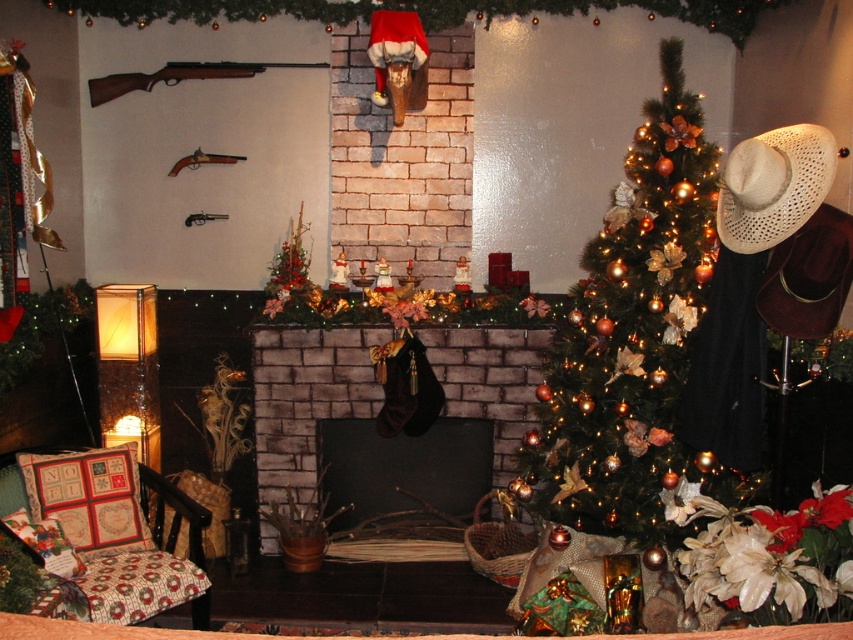
Question: Does brick fireplace at center appear over beige woven cowboy hat at right?

Choices:
 (A) no
 (B) yes

Answer: (A)

Question: Among these points, which one is farthest from the camera?

Choices:
 (A) (270, 352)
 (B) (671, 429)
 (C) (749, 195)

Answer: (A)

Question: Which of the following is the closest to the observer?

Choices:
 (A) pyautogui.click(x=416, y=332)
 (B) pyautogui.click(x=743, y=218)

Answer: (B)

Question: Estimate the real-world distances between objects in this image. Which object is closer to the green matte christmas tree at center?

Choices:
 (A) beige woven cowboy hat at right
 (B) brick fireplace at center

Answer: (A)

Question: Can you confirm if green matte christmas tree at center is wider than beige woven cowboy hat at right?

Choices:
 (A) no
 (B) yes

Answer: (B)

Question: Does green matte christmas tree at center appear on the right side of brick fireplace at center?

Choices:
 (A) yes
 (B) no

Answer: (A)